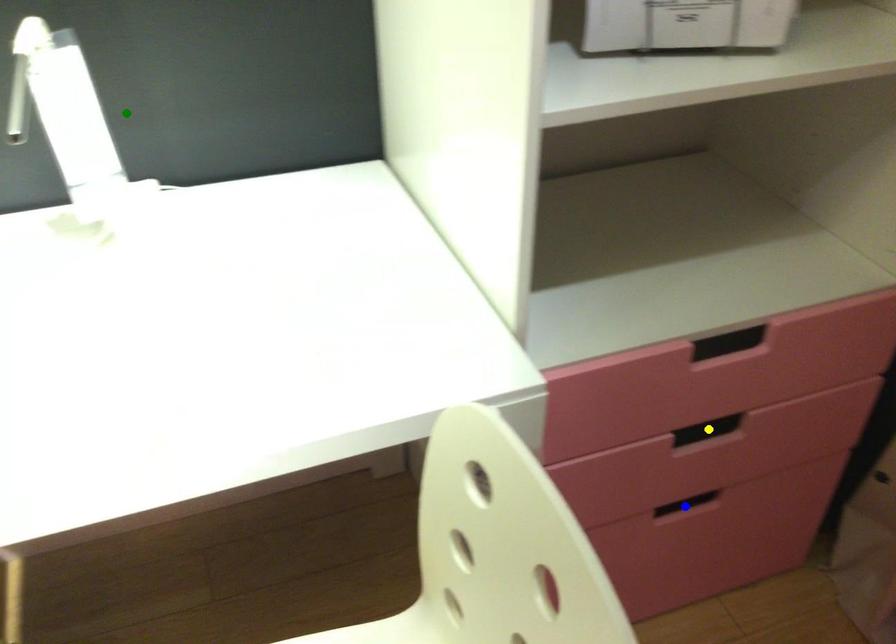
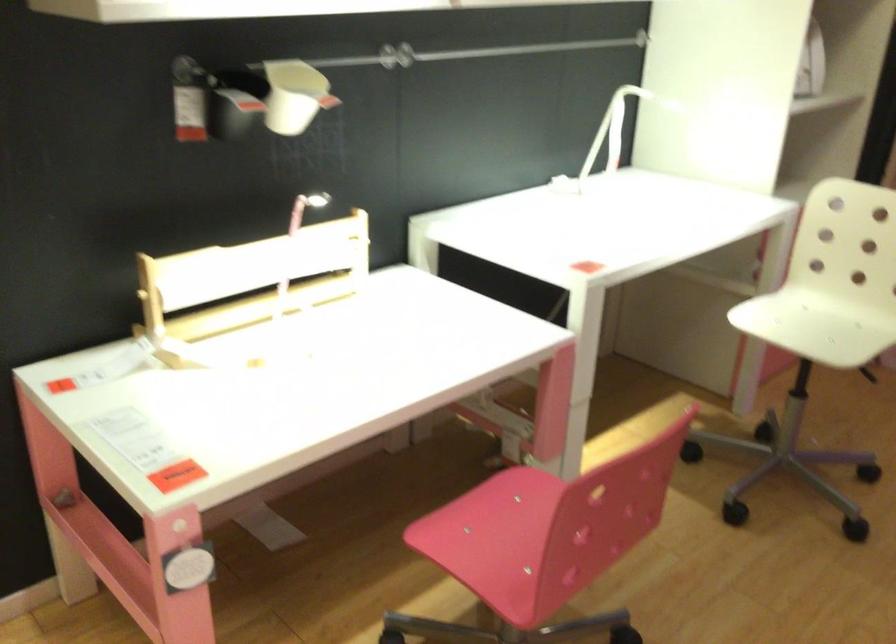
I am providing you with two images of the same scene from different viewpoints. Three points are marked in image1. Which point corresponds to a part or object that is occluded in image2?In image1, three points are marked. Which of them correspond to a part or object that is occluded in image2?Among the three points shown in image1, which one corresponds to a part or object that is no longer visible due to occlusion in image2?

yellow point, blue point cannot be seen in image2.